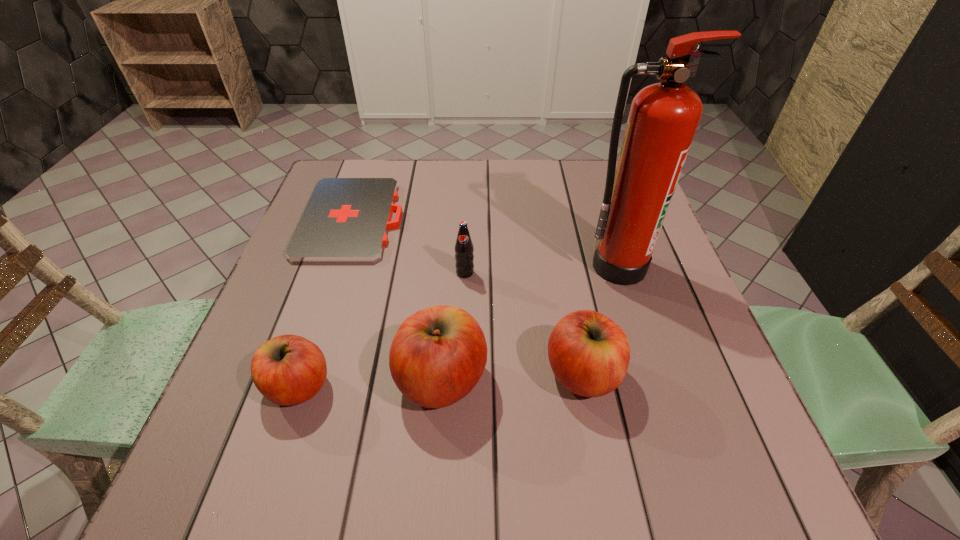
Identify the location of vacant area that lies between the first-aid kit and the shortest apple. The width and height of the screenshot is (960, 540). (325, 303).

This screenshot has width=960, height=540. I want to click on free spot between the first-aid kit and the leftmost apple, so tap(325, 303).

Locate an element on the screen. This screenshot has width=960, height=540. vacant space in between the shortest object and the pop is located at coordinates (409, 246).

The height and width of the screenshot is (540, 960). In order to click on free area in between the fifth tallest object and the pop in this screenshot , I will do `click(382, 329)`.

Identify the location of free space between the second apple from right to left and the tallest object. (529, 323).

Locate which object ranks fifth in proximity to the second apple from left to right. Please provide its 2D coordinates. Your answer should be formatted as a tuple, i.e. [(x, y)], where the tuple contains the x and y coordinates of a point satisfying the conditions above.

[(663, 119)]

Select which object appears as the fifth closest to the second shortest object. Please provide its 2D coordinates. Your answer should be formatted as a tuple, i.e. [(x, y)], where the tuple contains the x and y coordinates of a point satisfying the conditions above.

[(663, 119)]

Locate an element on the screen. The height and width of the screenshot is (540, 960). apple that is the second closest to the second apple from right to left is located at coordinates (288, 370).

Identify the location of apple that is the third closest to the pop. The height and width of the screenshot is (540, 960). (288, 370).

I want to click on vacant space that satisfies the following two spatial constraints: 1. on handle side the first-aid kit; 2. on the right side of the rightmost apple, so click(x=301, y=374).